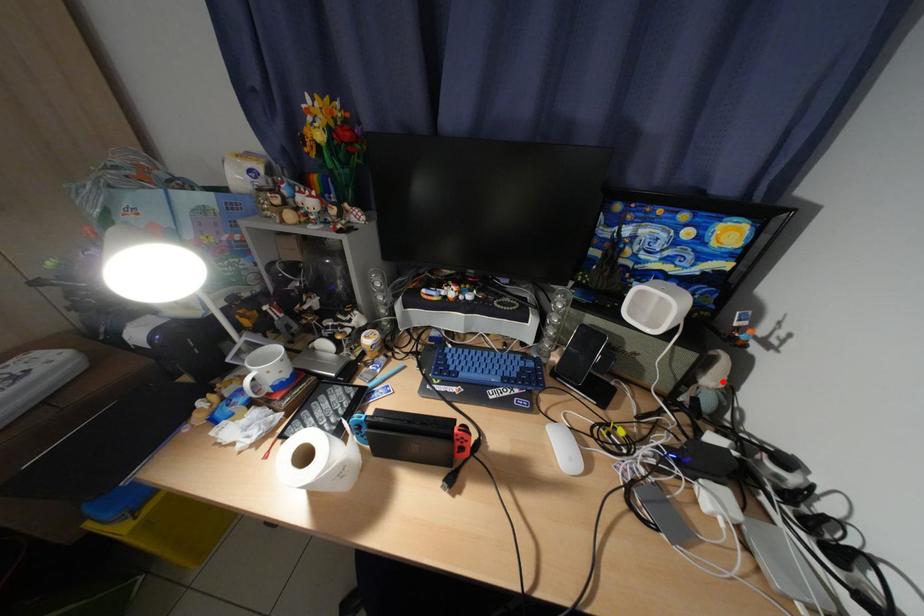
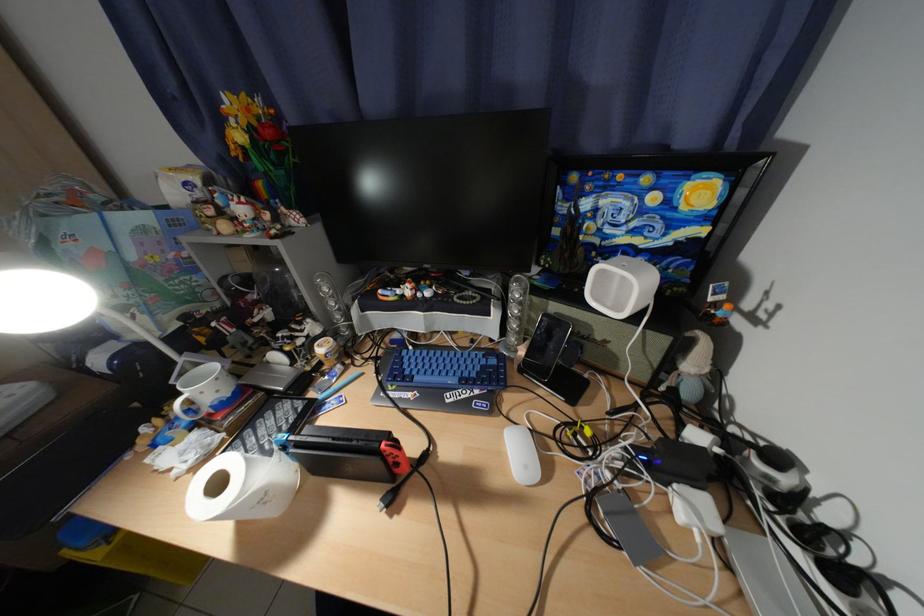
Locate, in the second image, the point that corresponds to the highlighted location in the first image.

(704, 367)